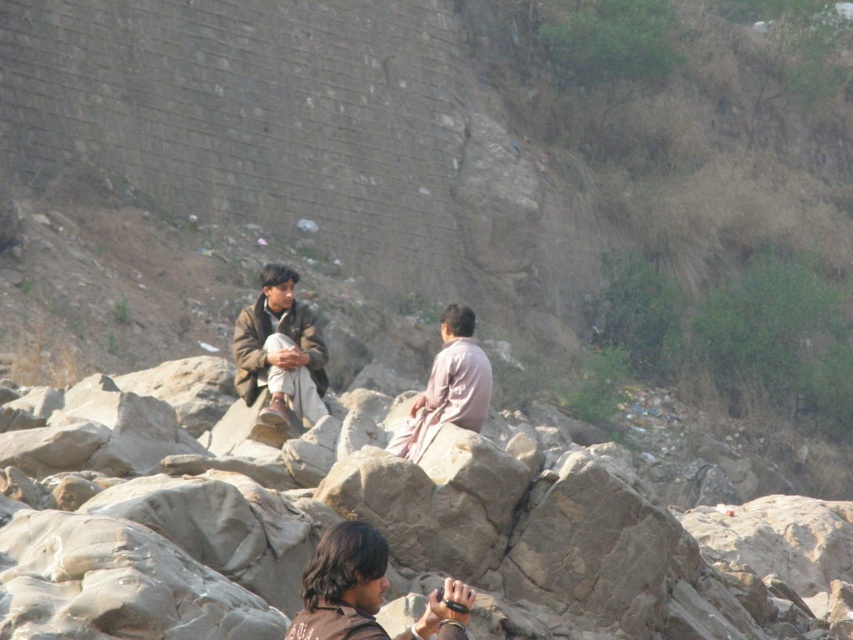
Question: Does brown leather jacket at lower center lie behind pale pink fabric at center?

Choices:
 (A) no
 (B) yes

Answer: (A)

Question: Which object is closer to the camera taking this photo?

Choices:
 (A) brown leather jacket at center
 (B) brown leather jacket at lower center

Answer: (B)

Question: Does smooth rock at center have a greater width compared to pale pink fabric at center?

Choices:
 (A) yes
 (B) no

Answer: (A)

Question: Which of the following is the closest to the observer?

Choices:
 (A) (430, 422)
 (B) (355, 634)

Answer: (B)

Question: Which point is closer to the camera taking this photo?

Choices:
 (A) (312, 400)
 (B) (447, 602)
 (C) (477, 422)
 (D) (299, 483)

Answer: (B)

Question: Does smooth rock at center appear on the right side of pale pink fabric at center?

Choices:
 (A) yes
 (B) no

Answer: (B)